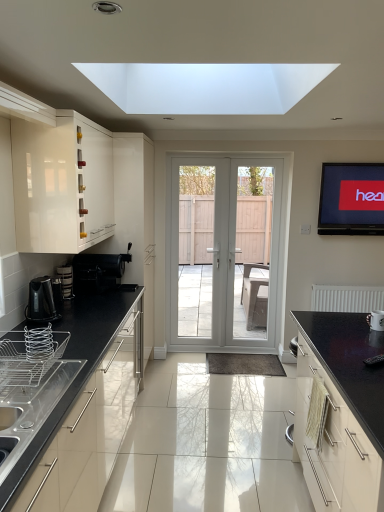
What is the approximate width of white glossy mug at lower right, the third appliance viewed from the left?

white glossy mug at lower right, the third appliance viewed from the left, is 5.07 inches wide.

Locate an element on the screen. Image resolution: width=384 pixels, height=512 pixels. white glossy mug at lower right, the third appliance viewed from the left is located at coordinates (376, 320).

In order to face black plastic coffee machine at lower left, should I rotate leftwards or rightwards?

You should rotate left by 11.455 degrees.

I want to click on white glossy screen door at center, the 2th screen door from the right, so click(199, 251).

The image size is (384, 512). Find the location of `black glossy electric kettle at lower left`. black glossy electric kettle at lower left is located at coordinates (41, 301).

Is white glossy screen door at center, the 2th screen door from the right, not inside black plastic coffee machine at lower left?

Yes, white glossy screen door at center, the 2th screen door from the right, is outside of black plastic coffee machine at lower left.

Who is smaller, white glossy screen door at center, which ranks as the first screen door in left-to-right order, or black plastic coffee machine at lower left?

black plastic coffee machine at lower left is smaller.

Is white glossy screen door at center, which ranks as the first screen door in left-to-right order, oriented away from black plastic coffee machine at lower left?

That's not correct — white glossy screen door at center, which ranks as the first screen door in left-to-right order, is not looking away from black plastic coffee machine at lower left.

Is the surface of white glossy screen door at center, which ranks as the first screen door in left-to-right order, in direct contact with black plastic coffee machine at lower left?

No, white glossy screen door at center, which ranks as the first screen door in left-to-right order, is not touching black plastic coffee machine at lower left.

From a real-world perspective, is white glossy door at center physically located above or below matte black tv at upper right?

From a real-world perspective, white glossy door at center is physically below matte black tv at upper right.

Is white glossy door at center directly adjacent to matte black tv at upper right?

No.

Is white glossy door at center not within matte black tv at upper right?

Yes, white glossy door at center is located beyond the bounds of matte black tv at upper right.

Who is bigger, white glossy door at center or matte black tv at upper right?

white glossy door at center is bigger.

Which of these two, metallic silver kettle at lower left, which is the 3th appliance from front to back, or white glossy screen door at center, the 2th screen door from the right, is thinner?

Thinner between the two is metallic silver kettle at lower left, which is the 3th appliance from front to back.

Is metallic silver kettle at lower left, placed as the 1th appliance when sorted from back to front, looking in the opposite direction of white glossy screen door at center, which ranks as the first screen door in left-to-right order?

No, metallic silver kettle at lower left, placed as the 1th appliance when sorted from back to front,'s orientation is not away from white glossy screen door at center, which ranks as the first screen door in left-to-right order.

From the image's perspective, would you say metallic silver kettle at lower left, placed as the 1th appliance when sorted from back to front, is shown under white glossy screen door at center, the 2th screen door from the right?

Indeed, from the image's perspective, metallic silver kettle at lower left, placed as the 1th appliance when sorted from back to front, is shown beneath white glossy screen door at center, the 2th screen door from the right.

Between point (64, 267) and point (200, 166), which one is positioned in front?

Positioned in front is point (64, 267).

Who is shorter, matte black tv at upper right or metallic silver kettle at lower left, which ranks as the 1th appliance in left-to-right order?

metallic silver kettle at lower left, which ranks as the 1th appliance in left-to-right order, is shorter.

From the image's perspective, who appears lower, matte black tv at upper right or metallic silver kettle at lower left, which is the 3th appliance from front to back?

metallic silver kettle at lower left, which is the 3th appliance from front to back.

Does point (380, 167) lie in front of point (61, 275)?

No, it is behind (61, 275).

Does matte black tv at upper right appear on the right side of metallic silver kettle at lower left, the 3th appliance in the right-to-left sequence?

Indeed, matte black tv at upper right is positioned on the right side of metallic silver kettle at lower left, the 3th appliance in the right-to-left sequence.

Is white glossy mug at lower right, the third appliance viewed from the left, at the back of white glossy door at center?

No, white glossy door at center is not facing away from white glossy mug at lower right, the third appliance viewed from the left.

Is white glossy door at center inside the boundaries of white glossy mug at lower right, which appears as the 1th appliance when viewed from the right, or outside?

white glossy door at center lies outside white glossy mug at lower right, which appears as the 1th appliance when viewed from the right.

This screenshot has width=384, height=512. Find the location of `appliance on the right of the white glossy door at center`. appliance on the right of the white glossy door at center is located at coordinates (376, 320).

From a real-world perspective, does white glossy door at center sit lower than white glossy mug at lower right, which appears as the 1th appliance when viewed from the right?

No, from a real-world perspective, white glossy door at center is not beneath white glossy mug at lower right, which appears as the 1th appliance when viewed from the right.

Considering the relative sizes of white glossy mug at lower right, the third appliance viewed from the left, and black plastic coffee machine at lower left in the image provided, is white glossy mug at lower right, the third appliance viewed from the left, taller than black plastic coffee machine at lower left?

Incorrect, the height of white glossy mug at lower right, the third appliance viewed from the left, is not larger of that of black plastic coffee machine at lower left.

Measure the distance between white glossy mug at lower right, the 2th appliance viewed from the front, and black plastic coffee machine at lower left.

white glossy mug at lower right, the 2th appliance viewed from the front, and black plastic coffee machine at lower left are 6.41 feet apart.

From a real-world perspective, who is located higher, white glossy mug at lower right, the third appliance viewed from the left, or black plastic coffee machine at lower left?

black plastic coffee machine at lower left is physically above.

From the picture: Is white glossy mug at lower right, the third appliance viewed from the left, outside of black plastic coffee machine at lower left?

white glossy mug at lower right, the third appliance viewed from the left, is positioned outside black plastic coffee machine at lower left.

Is white glossy door at center inside or outside of silver metallic wire basket at lower left, which appears as the first appliance when viewed from the front?

white glossy door at center is not inside silver metallic wire basket at lower left, which appears as the first appliance when viewed from the front, it's outside.

Who is shorter, white glossy door at center or silver metallic wire basket at lower left, which is the 2th appliance in right-to-left order?

silver metallic wire basket at lower left, which is the 2th appliance in right-to-left order, is shorter.

This screenshot has height=512, width=384. Find the location of `door on the right side of silver metallic wire basket at lower left, which appears as the first appliance when viewed from the front`. door on the right side of silver metallic wire basket at lower left, which appears as the first appliance when viewed from the front is located at coordinates (224, 253).

Is white glossy door at center far from silver metallic wire basket at lower left, placed as the second appliance when sorted from left to right?

That's right, there is a large distance between white glossy door at center and silver metallic wire basket at lower left, placed as the second appliance when sorted from left to right.

I want to click on coffee machine below the white glossy screen door at center, which ranks as the first screen door in left-to-right order (from the image's perspective), so click(x=98, y=271).

The image size is (384, 512). What are the coordinates of `door beneath the matte black tv at upper right (from a real-world perspective)` in the screenshot? It's located at (224, 253).

Estimate the real-world distances between objects in this image. Which object is further from black glossy electric kettle at lower left, white glossy mug at lower right, which is the second appliance from back to front, or white glossy door at center, the second screen door when ordered from left to right?

The object further to black glossy electric kettle at lower left is white glossy door at center, the second screen door when ordered from left to right.

When comparing their distances from white glossy mug at lower right, which is the second appliance from back to front, does white glossy door at center, the second screen door when ordered from left to right, or black plastic coffee machine at lower left seem further?

The object further to white glossy mug at lower right, which is the second appliance from back to front, is white glossy door at center, the second screen door when ordered from left to right.

Looking at the image, which one is located further to silver metallic wire basket at lower left, which appears as the first appliance when viewed from the front, metallic silver kettle at lower left, placed as the 1th appliance when sorted from back to front, or white glossy mug at lower right, the 2th appliance viewed from the front?

The object further to silver metallic wire basket at lower left, which appears as the first appliance when viewed from the front, is white glossy mug at lower right, the 2th appliance viewed from the front.

Looking at the image, which one is located closer to white glossy door at center, metallic silver kettle at lower left, which is the 3th appliance from front to back, or white glossy mug at lower right, the third appliance viewed from the left?

metallic silver kettle at lower left, which is the 3th appliance from front to back, lies closer to white glossy door at center than the other object.

Considering their positions, is glossy black countertop at right, placed as the second cabinetry when sorted from left to right, positioned further to white glossy door at center, the second screen door when ordered from left to right, than white glossy screen door at center, which ranks as the first screen door in left-to-right order?

glossy black countertop at right, placed as the second cabinetry when sorted from left to right, is positioned further to the anchor white glossy door at center, the second screen door when ordered from left to right.

Consider the image. From the image, which object appears to be farther from black plastic coffee machine at lower left, black glossy electric kettle at lower left or white glossy mug at lower right, which appears as the 1th appliance when viewed from the right?

Among the two, white glossy mug at lower right, which appears as the 1th appliance when viewed from the right, is located further to black plastic coffee machine at lower left.

Estimate the real-world distances between objects in this image. Which object is further from metallic silver kettle at lower left, which ranks as the 1th appliance in left-to-right order, white glossy mug at lower right, the 2th appliance viewed from the front, or white glossy door at center?

Among the two, white glossy door at center is located further to metallic silver kettle at lower left, which ranks as the 1th appliance in left-to-right order.

Based on their spatial positions, is silver metallic wire basket at lower left, which ranks as the 3th appliance in back-to-front order, or glossy white cabinet at left, positioned as the second cabinetry in bottom-to-top order, closer to metallic silver kettle at lower left, which ranks as the 1th appliance in left-to-right order?

Based on the image, glossy white cabinet at left, positioned as the second cabinetry in bottom-to-top order, appears to be nearer to metallic silver kettle at lower left, which ranks as the 1th appliance in left-to-right order.

Find the location of a particular element. cabinetry located between silver metallic wire basket at lower left, which appears as the first appliance when viewed from the front, and white glossy mug at lower right, which appears as the 1th appliance when viewed from the right, in the left-right direction is located at coordinates [x=341, y=412].

In order to click on coffee machine between glossy white cabinet at left, which is counted as the first cabinetry, starting from the left, and white glossy door at center, along the z-axis in this screenshot , I will do `click(98, 271)`.

Identify the location of kitchen appliance between glossy black countertop at right, placed as the second cabinetry when sorted from left to right, and black plastic coffee machine at lower left, along the z-axis. (41, 301).

Locate an element on the screen. door situated between metallic silver kettle at lower left, placed as the 1th appliance when sorted from back to front, and white matte radiator at right from left to right is located at coordinates (224, 253).